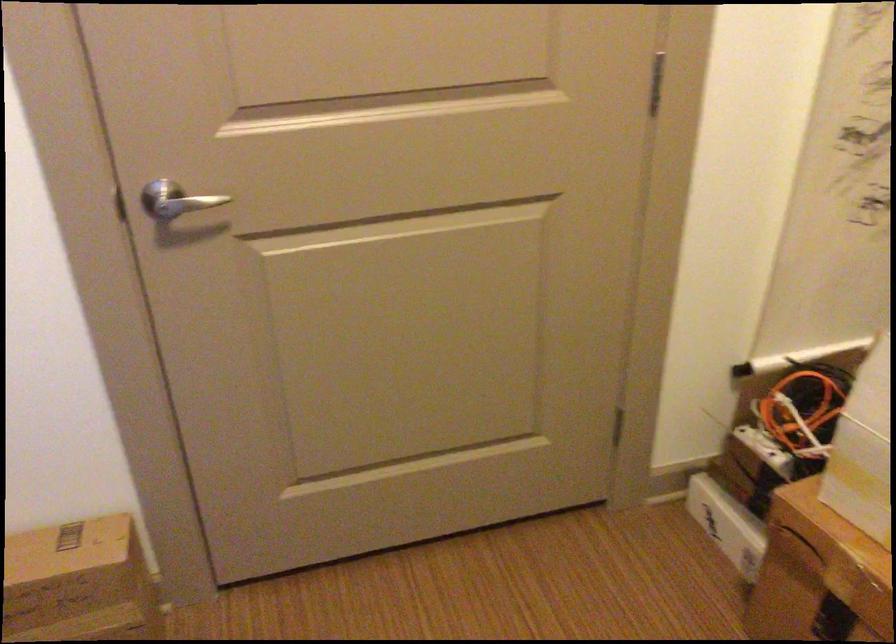
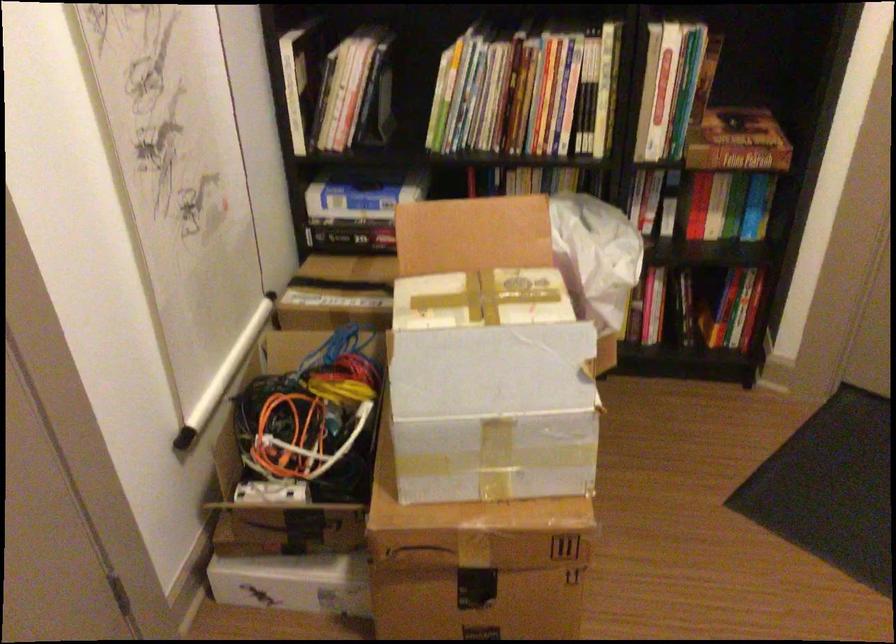
In the second image, find the point that corresponds to point (745, 527) in the first image.

(293, 583)